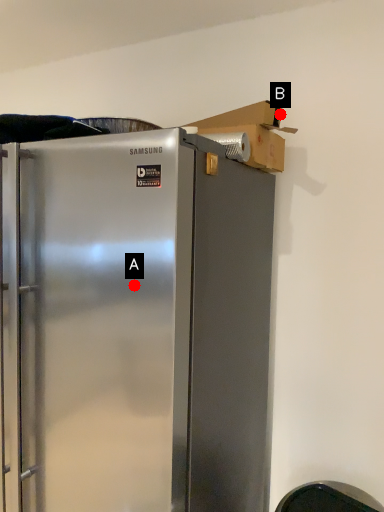
Question: Two points are circled on the image, labeled by A and B beside each circle. Which point appears closest to the camera in this image?

Choices:
 (A) A is closer
 (B) B is closer

Answer: (A)